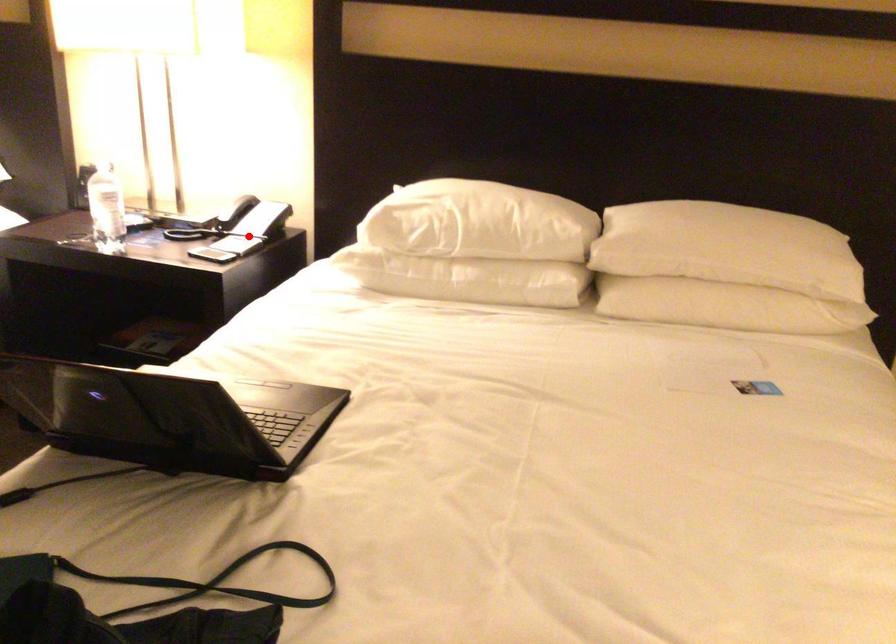
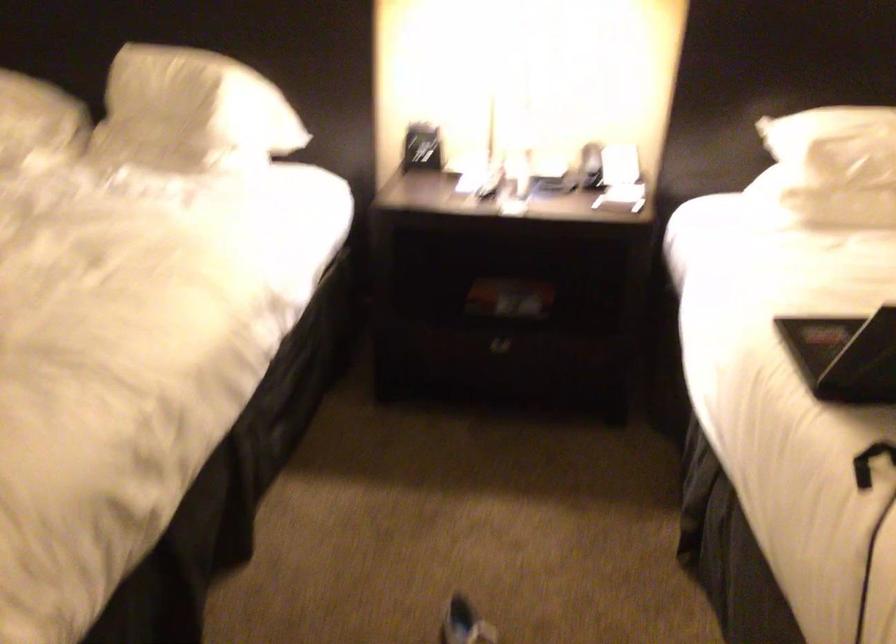
In the second image, find the point that corresponds to the highlighted location in the first image.

(609, 176)